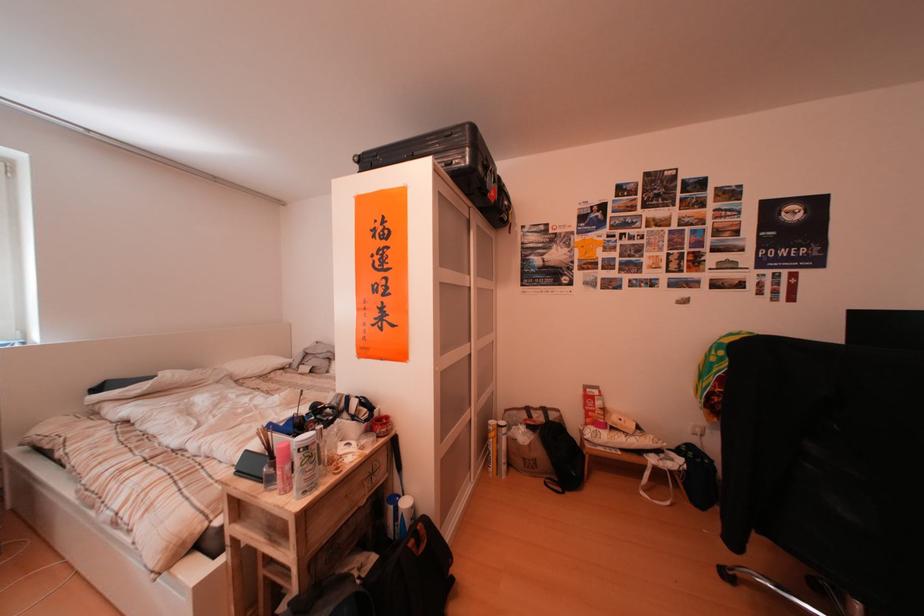
You are a GUI agent. You are given a task and a screenshot of the screen. Output one action in this format:
    pyautogui.click(x=<x>, y=<y>)
    Task: Click on the black suitcase
    The image size is (924, 616).
    Given the screenshot: What is the action you would take?
    pyautogui.click(x=441, y=156)